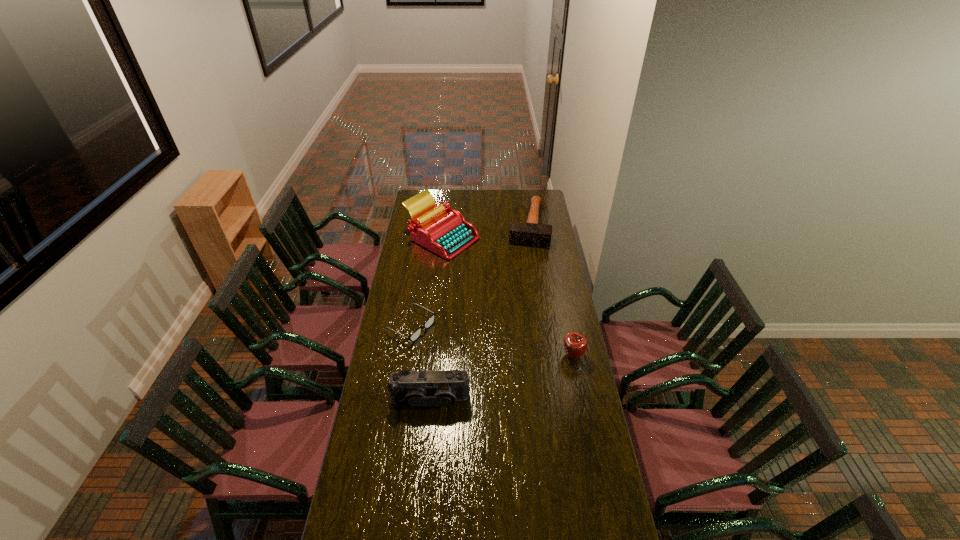
The width and height of the screenshot is (960, 540). What are the coordinates of `blank area in the image that satisfies the following two spatial constraints: 1. on the front side of the apple; 2. on the left side of the fourth tallest object` in the screenshot? It's located at (546, 356).